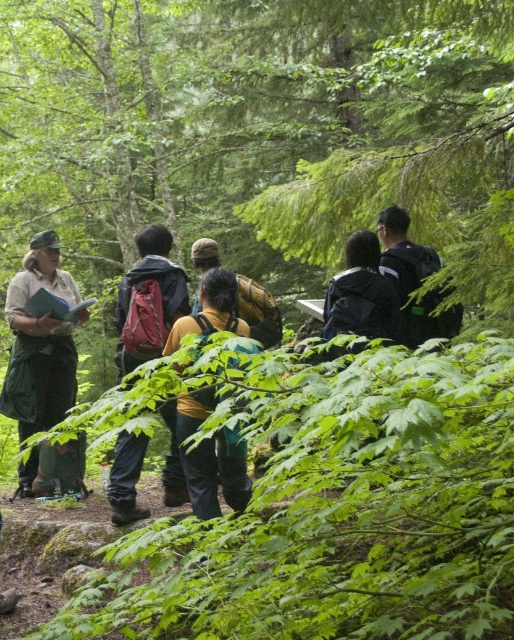
You are part of a hiking group in the forest. You notice the green uniform at left and the matte red backpack at center. Which object is closer to you?

The green uniform at left is closer to you because the matte red backpack at center is behind it.

You are a hiker trying to locate the guide in the forest. The guide is wearing a green uniform at left and has a yellow fabric backpack at center. Which object is taller?

The green uniform at left is much taller than the yellow fabric backpack at center.

You are part of the group in the forest and need to identify the widest item between the green uniform at left and the yellow fabric backpack at center. Which one is wider?

The green uniform at left is wider than the yellow fabric backpack at center.